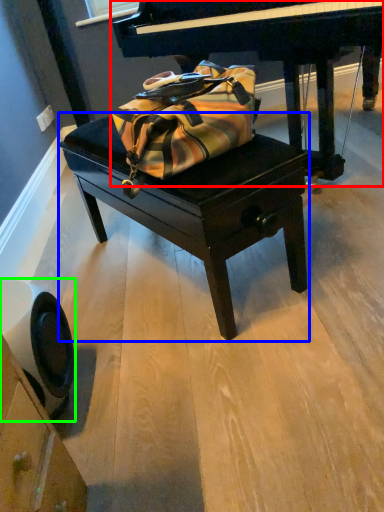
Question: Which object is the closest to the piano (highlighted by a red box)? Choose among these: table (highlighted by a blue box) or swivel chair (highlighted by a green box).

Choices:
 (A) table
 (B) swivel chair

Answer: (A)